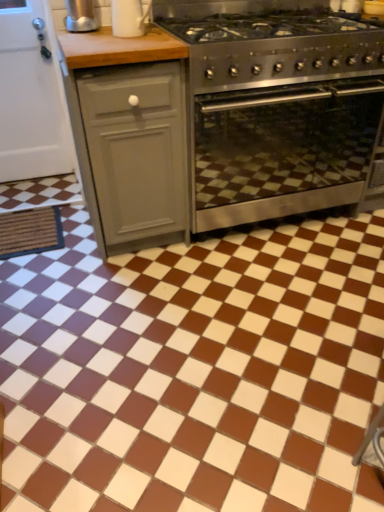
Question: Is stainless steel gas stove at center wider or thinner than white glossy mug at upper center?

Choices:
 (A) wide
 (B) thin

Answer: (A)

Question: Relative to white glossy mug at upper center, is stainless steel gas stove at center in front or behind?

Choices:
 (A) behind
 (B) front

Answer: (B)

Question: Which of these objects is positioned closest to the brown glossy tile at center?

Choices:
 (A) stainless steel oven at center
 (B) white glossy mug at upper center
 (C) stainless steel gas stove at center
 (D) satin silver kettle at upper left
 (E) gray matte cabinet at left

Answer: (E)

Question: Estimate the real-world distances between objects in this image. Which object is farther from the gray matte cabinet at left?

Choices:
 (A) stainless steel oven at center
 (B) satin silver kettle at upper left
 (C) white glossy mug at upper center
 (D) brown glossy tile at center
 (E) stainless steel gas stove at center

Answer: (D)